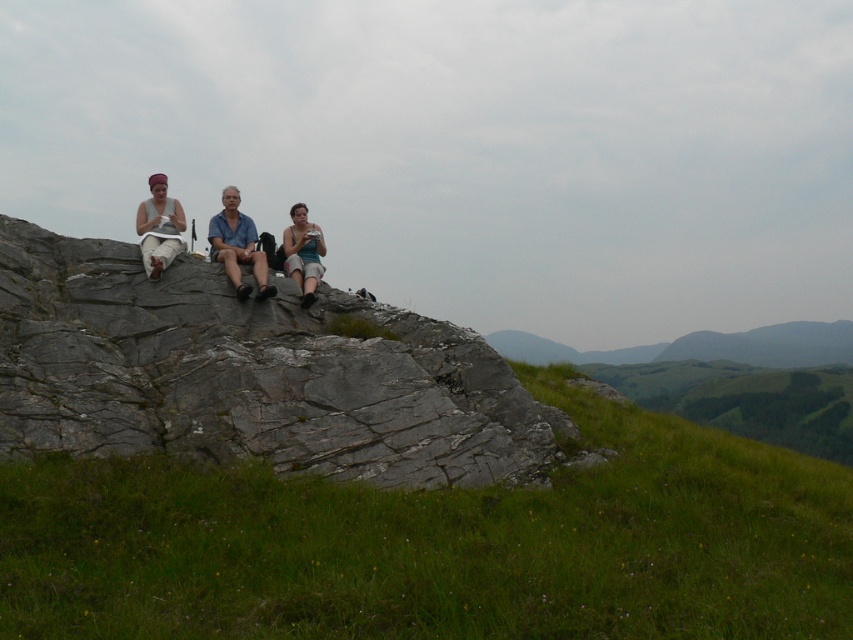
Question: Does blue denim shirt at center have a lesser width compared to matte blue tank top at center?

Choices:
 (A) yes
 (B) no

Answer: (B)

Question: Which point is farther from the camera taking this photo?

Choices:
 (A) (140, 241)
 (B) (228, 237)
 (C) (259, 276)

Answer: (B)

Question: Which point is farther to the camera?

Choices:
 (A) (167, 209)
 (B) (308, 230)
 (C) (49, 371)
 (D) (233, 280)

Answer: (B)

Question: In this image, where is matte gray rock at center located relative to matte blue tank top at center?

Choices:
 (A) right
 (B) left

Answer: (B)

Question: From the image, what is the correct spatial relationship of matte gray rock at center in relation to matte blue tank top at center?

Choices:
 (A) left
 (B) right

Answer: (A)

Question: Which point is farther to the camera?

Choices:
 (A) (235, 291)
 (B) (213, 257)
 (C) (289, 228)
 (D) (7, 256)

Answer: (C)